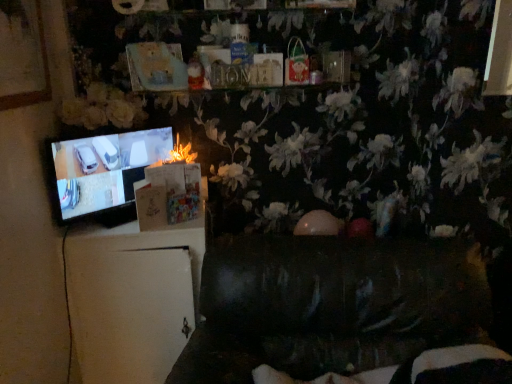
Question: Is dark leather couch at lower center inside or outside of black glossy television at left?

Choices:
 (A) inside
 (B) outside

Answer: (B)

Question: Is dark leather couch at lower center taller or shorter than black glossy television at left?

Choices:
 (A) short
 (B) tall

Answer: (B)

Question: Based on their relative distances, which object is nearer to the black glossy television at left?

Choices:
 (A) fluffy paper at center
 (B) dark leather couch at lower center

Answer: (A)

Question: Estimate the real-world distances between objects in this image. Which object is farther from the fluffy paper at center?

Choices:
 (A) dark leather couch at lower center
 (B) black glossy television at left

Answer: (A)